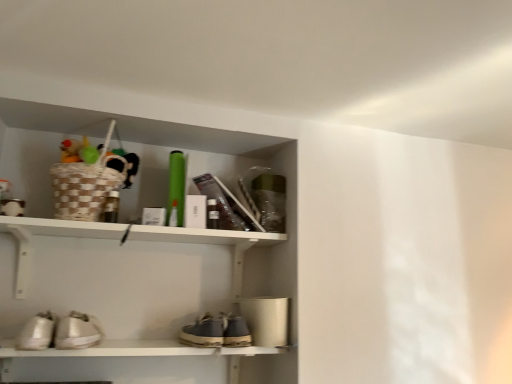
Question: From the image's perspective, is shiny metallic sneakers at lower left, which is the 1th footwear from right to left, under leather suede shoe at center?

Choices:
 (A) yes
 (B) no

Answer: (B)

Question: Is shiny metallic sneakers at lower left, placed as the 2th footwear when sorted from left to right, smaller than leather suede shoe at center?

Choices:
 (A) yes
 (B) no

Answer: (B)

Question: Can you confirm if shiny metallic sneakers at lower left, which is the 1th footwear from right to left, is positioned to the left of leather suede shoe at center?

Choices:
 (A) no
 (B) yes

Answer: (B)

Question: Is shiny metallic sneakers at lower left, placed as the 2th footwear when sorted from left to right, directly adjacent to leather suede shoe at center?

Choices:
 (A) yes
 (B) no

Answer: (B)

Question: From the image's perspective, is shiny metallic sneakers at lower left, which is the 1th footwear from right to left, above leather suede shoe at center?

Choices:
 (A) no
 (B) yes

Answer: (B)

Question: Does shiny metallic sneakers at lower left, which is the 1th footwear from right to left, have a larger size compared to leather suede shoe at center?

Choices:
 (A) no
 (B) yes

Answer: (B)

Question: From the image's perspective, is leather suede shoe at center above white matte shelf at upper center?

Choices:
 (A) no
 (B) yes

Answer: (A)

Question: From a real-world perspective, does leather suede shoe at center stand above white matte shelf at upper center?

Choices:
 (A) yes
 (B) no

Answer: (B)

Question: Is leather suede shoe at center closer to camera compared to white matte shelf at upper center?

Choices:
 (A) yes
 (B) no

Answer: (B)

Question: Can you confirm if leather suede shoe at center is positioned to the left of white matte shelf at upper center?

Choices:
 (A) yes
 (B) no

Answer: (B)

Question: From a real-world perspective, is leather suede shoe at center located beneath white matte shelf at upper center?

Choices:
 (A) yes
 (B) no

Answer: (A)

Question: Can you confirm if leather suede shoe at center is smaller than white matte shelf at upper center?

Choices:
 (A) no
 (B) yes

Answer: (B)

Question: From the image's perspective, is leather suede shoe at center below white leather sneakers at lower left, arranged as the first footwear when viewed from the left?

Choices:
 (A) yes
 (B) no

Answer: (A)